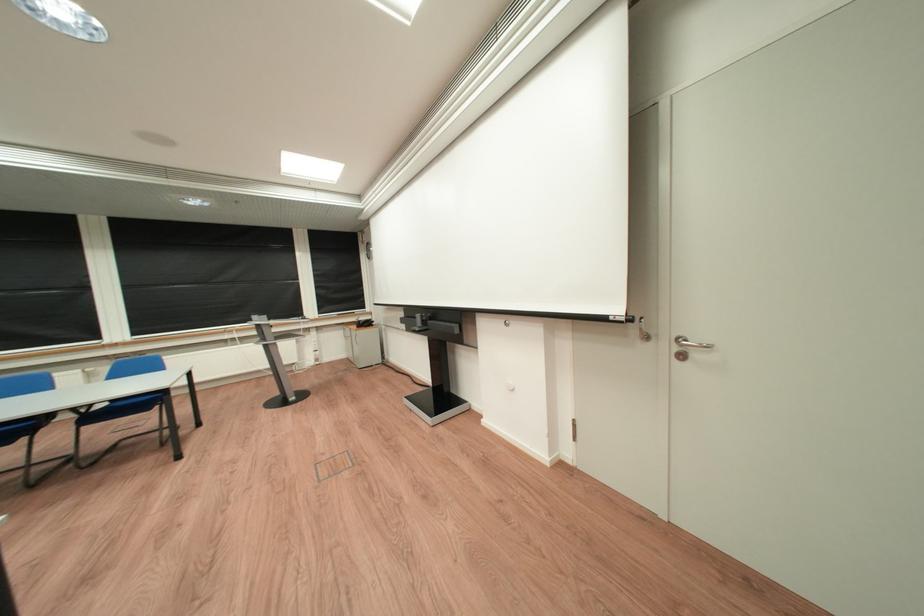
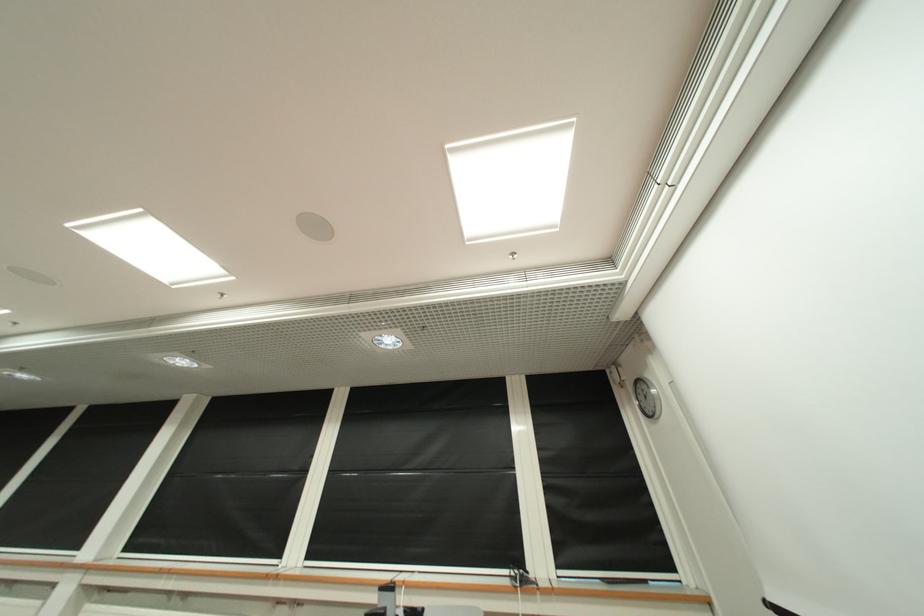
Find the pixel in the second image that matches point (329, 290) in the first image.

(558, 491)